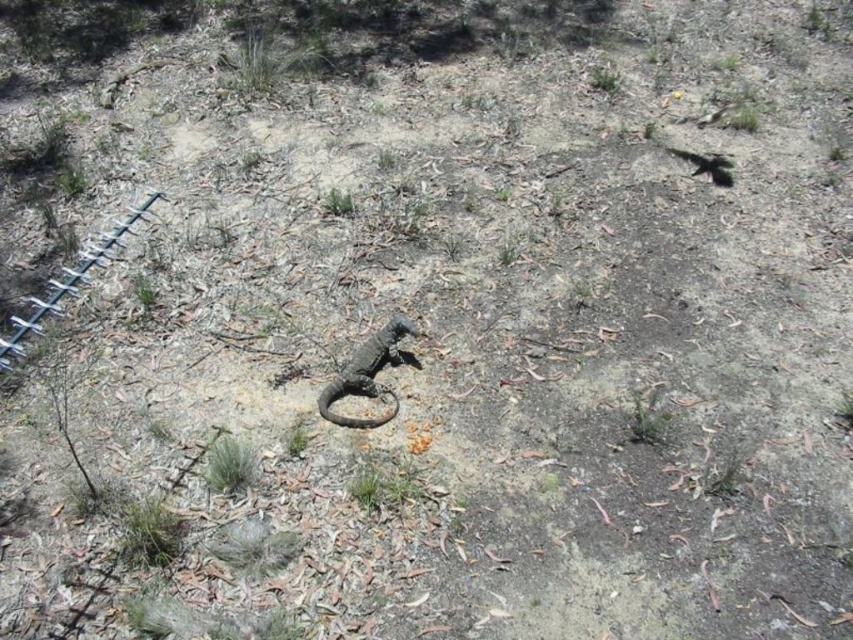
You are a drone operator trying to navigate a small drone between two points in the image. The first point is point (248, 45) and the second point is point (329, 211). Which point is closer to the drone when it is positioned at the starting point?

Point (248, 45) is closer to the drone because it is further to the viewer compared to point (329, 211).

In the scene shown: You are standing at the point labeled point (264, 54) in the image. What is the closest object to you in the scene?

The closest object to you at point (264, 54) is the green grass at upper center, as it is represented by that point.